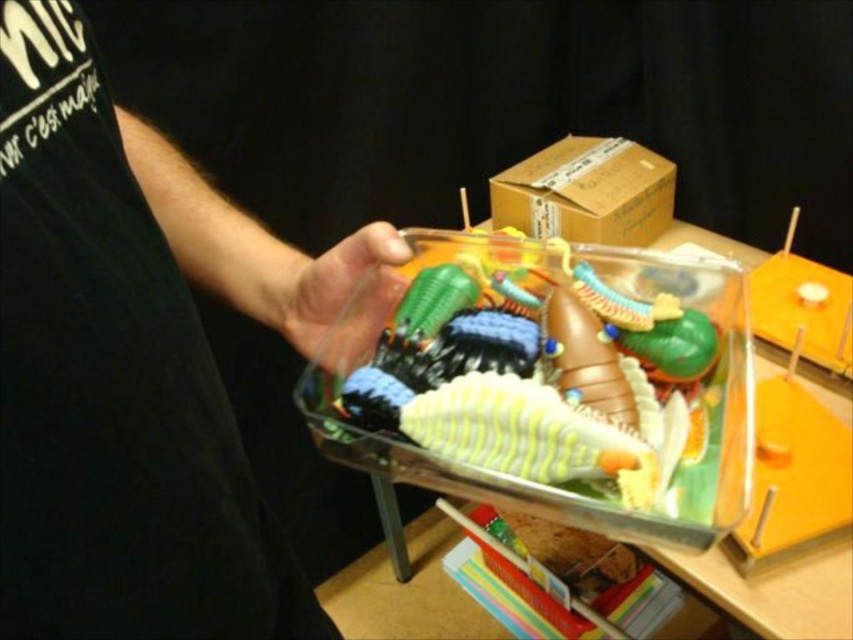
Based on the photo, you are a child who wants to choose a toy from the container. You see the matte plastic toy at upper center and the translucent plastic toy at center. Which one is larger?

The matte plastic toy at upper center is bigger than the translucent plastic toy at center.

You are a delivery person who needs to place a package on a shelf. The shelf has limited space between the brown cardboard box at upper center and the matte plastic hand at center. The package is 30 inches long. Can you fit the package between them?

The distance between the brown cardboard box at upper center and the matte plastic hand at center is 32.96 inches. Since the package is 30 inches long, it can fit between them as there is enough space.